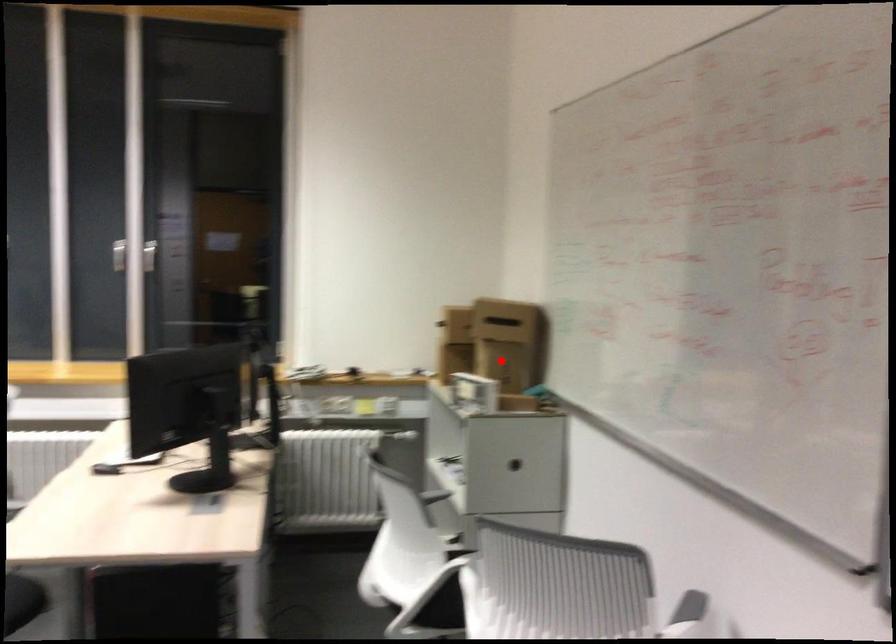
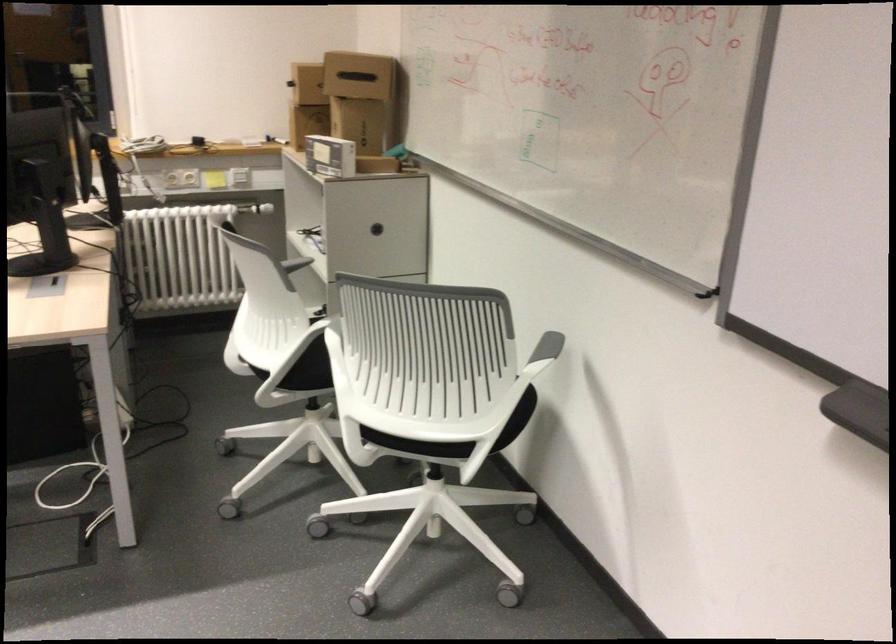
The point at the highlighted location is marked in the first image. Where is the corresponding point in the second image?

(366, 131)